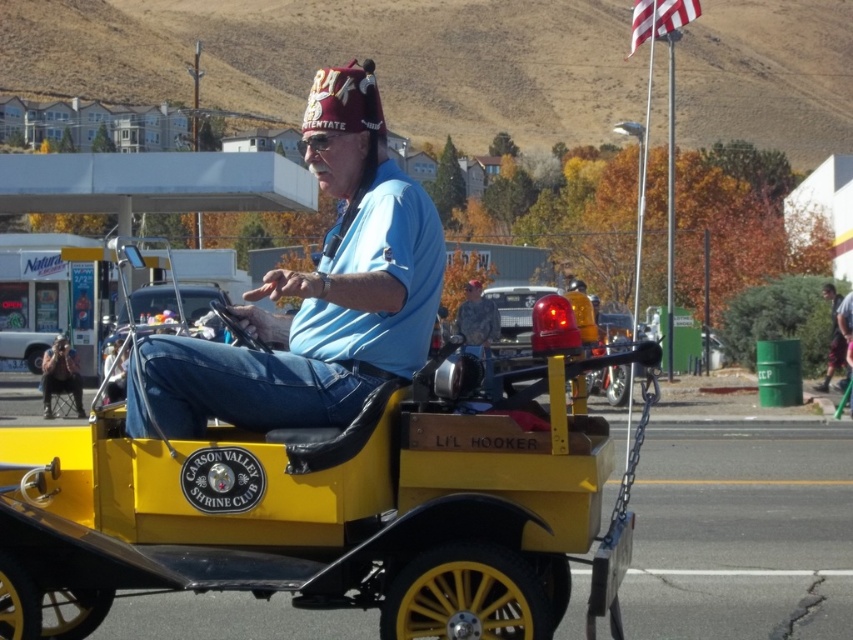
Question: Which of the following is the closest to the observer?

Choices:
 (A) (44, 387)
 (B) (540, 524)
 (C) (828, 365)
 (D) (187, 348)

Answer: (B)

Question: Can you confirm if yellow matte wagon at center is thinner than dark blue jeans at lower left?

Choices:
 (A) no
 (B) yes

Answer: (A)

Question: Which object appears closest to the camera in this image?

Choices:
 (A) yellow matte wagon at center
 (B) dark blue jeans at center
 (C) dark blue jeans at lower left

Answer: (A)

Question: Which of these objects is positioned closest to the dark blue jeans at lower left?

Choices:
 (A) matte blue shirt at center
 (B) yellow matte wagon at center

Answer: (A)

Question: From the image, what is the correct spatial relationship of yellow matte wagon at center in relation to matte blue shirt at center?

Choices:
 (A) right
 (B) left

Answer: (A)

Question: In this image, where is yellow matte wagon at center located relative to matte blue shirt at center?

Choices:
 (A) left
 (B) right

Answer: (B)